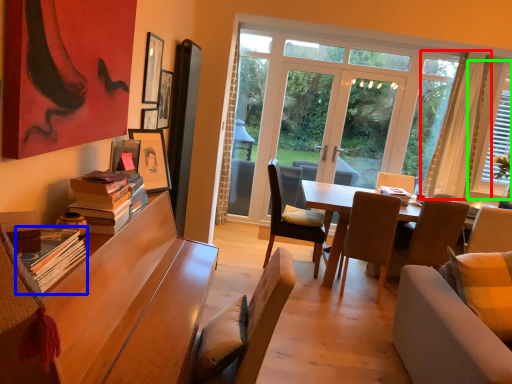
Question: Which object is positioned farthest from curtain (highlighted by a red box)? Select from book (highlighted by a blue box) and window (highlighted by a green box).

Choices:
 (A) book
 (B) window

Answer: (A)